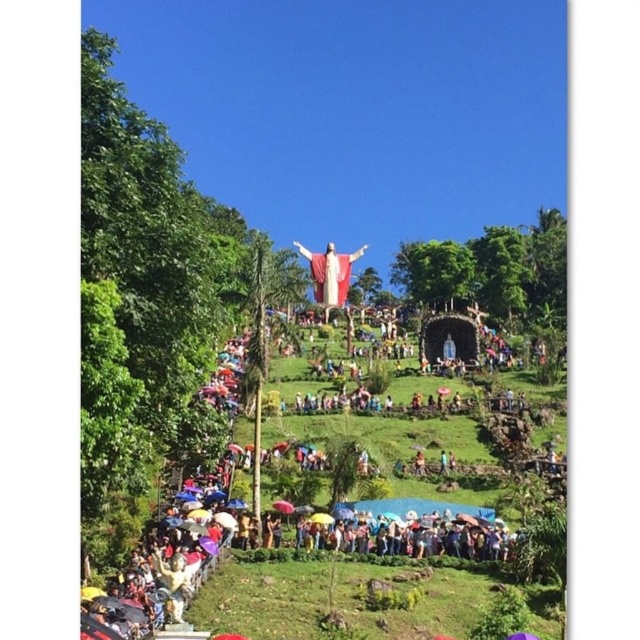
Is multicolored umbrellas at center to the right of polychrome statue at center from the viewer's perspective?

Indeed, multicolored umbrellas at center is positioned on the right side of polychrome statue at center.

Between multicolored umbrellas at center and polychrome statue at center, which one has less height?

multicolored umbrellas at center is shorter.

Find the location of a particular element. The image size is (640, 640). multicolored umbrellas at center is located at coordinates (429, 547).

What are the coordinates of `multicolored umbrellas at center` in the screenshot? It's located at (429, 547).